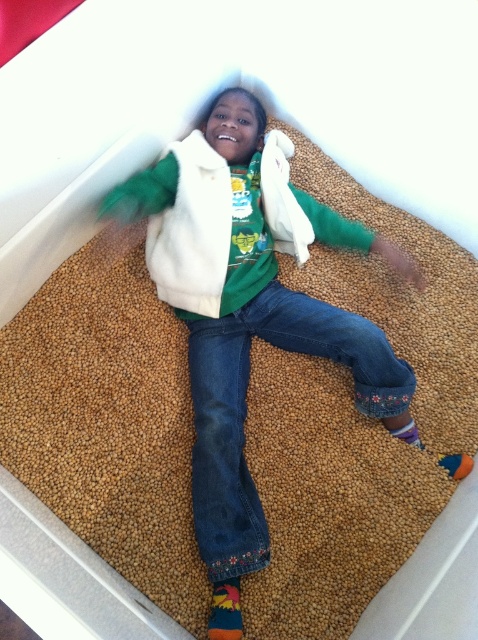
Between white fleece jacket at center and denim at center, which one is positioned higher?

Positioned higher is white fleece jacket at center.

The height and width of the screenshot is (640, 478). Identify the location of white fleece jacket at center. (249, 365).